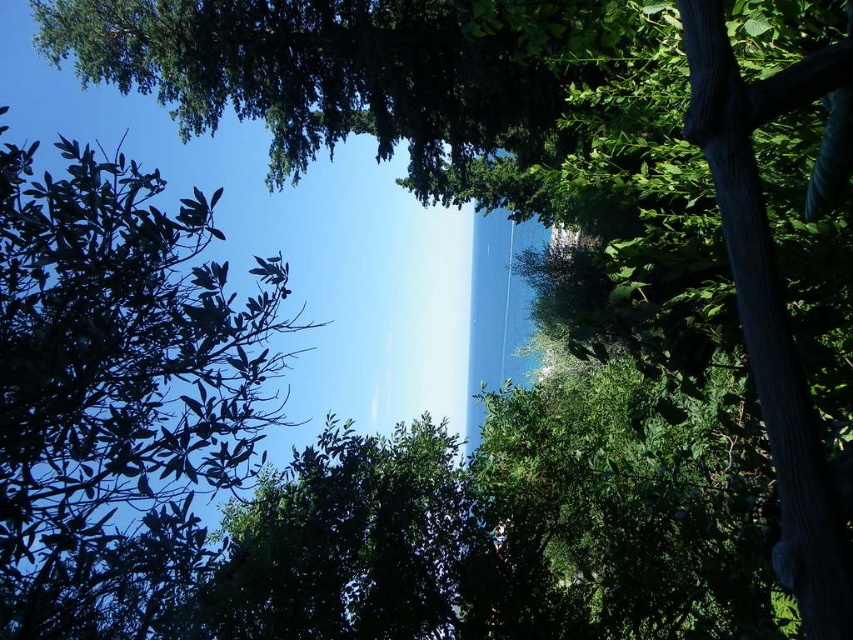
Question: Which of the following is the farthest from the observer?

Choices:
 (A) green leafy tree at upper left
 (B) green leafy tree at center

Answer: (B)

Question: Does green leafy tree at upper left have a smaller size compared to green leafy tree at center?

Choices:
 (A) no
 (B) yes

Answer: (B)

Question: Which point is closer to the camera?

Choices:
 (A) (200, 608)
 (B) (216, 353)

Answer: (B)

Question: Can you confirm if green leafy tree at upper left is bigger than green leafy tree at center?

Choices:
 (A) yes
 (B) no

Answer: (B)

Question: Which object is farther from the camera taking this photo?

Choices:
 (A) green leafy tree at upper left
 (B) green leafy tree at center

Answer: (B)

Question: Considering the relative positions of green leafy tree at upper left and green leafy tree at center in the image provided, where is green leafy tree at upper left located with respect to green leafy tree at center?

Choices:
 (A) right
 (B) left

Answer: (B)